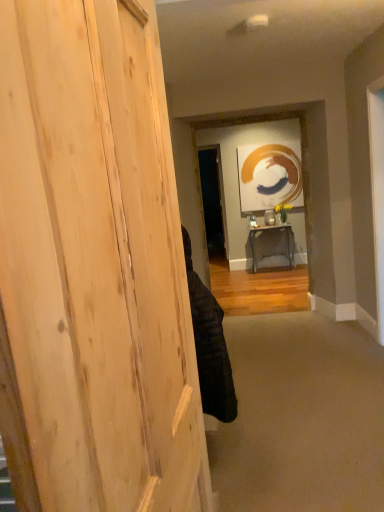
What are the coordinates of `free point below black fabric at center (from a real-world perspective)` in the screenshot? It's located at (233, 447).